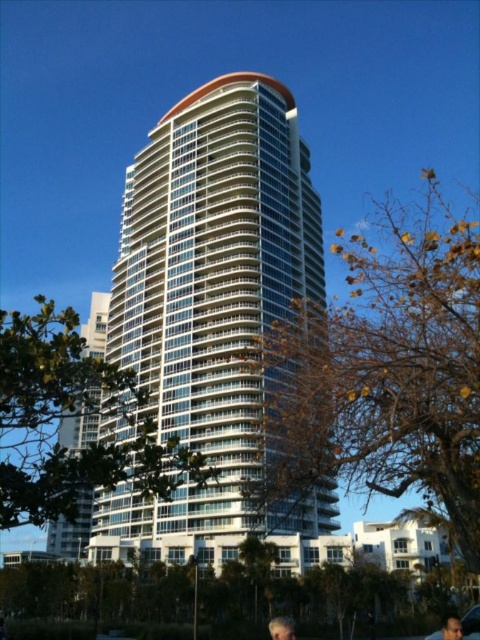
Question: Which of these objects is positioned closest to the smooth skin face at lower right?

Choices:
 (A) white glass building at center
 (B) white glass building at left

Answer: (A)

Question: Does white glass building at left appear over smooth skin face at lower right?

Choices:
 (A) yes
 (B) no

Answer: (A)

Question: Does white glass building at left appear under smooth skin face at lower right?

Choices:
 (A) no
 (B) yes

Answer: (A)

Question: Is white glass building at center to the left of smooth skin face at lower right from the viewer's perspective?

Choices:
 (A) yes
 (B) no

Answer: (A)

Question: Considering the real-world distances, which object is closest to the white glass building at left?

Choices:
 (A) smooth skin face at lower right
 (B) white glass building at center

Answer: (B)

Question: Which object appears farthest from the camera in this image?

Choices:
 (A) white glass building at left
 (B) white glass building at center
 (C) smooth skin face at lower right

Answer: (B)